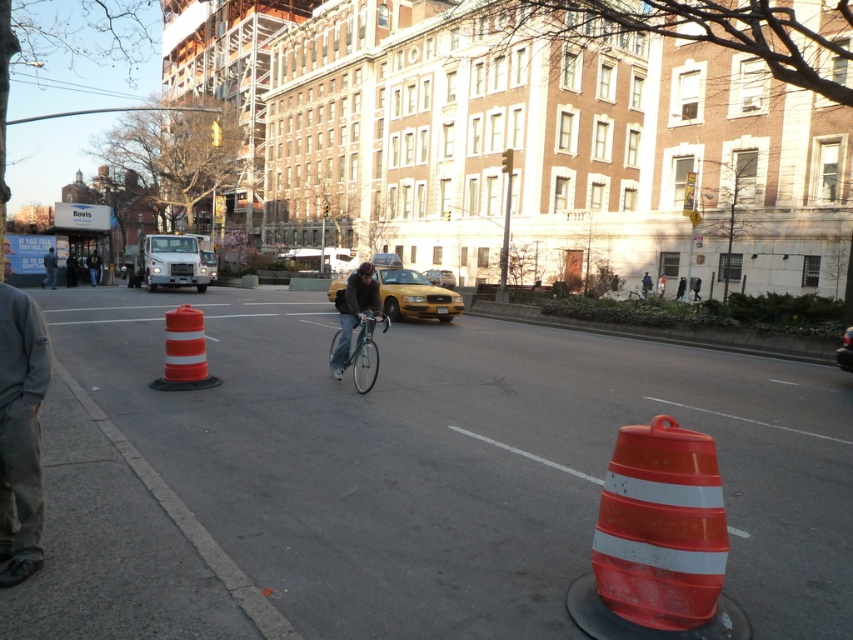
Can you confirm if dark gray pants at lower left is positioned below teal metallic bicycle at center?

Yes, dark gray pants at lower left is below teal metallic bicycle at center.

Between point (24, 458) and point (374, 348), which one is positioned in front?

Point (24, 458) is more forward.

Find the location of a particular element. dark gray pants at lower left is located at coordinates pyautogui.click(x=20, y=433).

Does orange reflective cone at center have a lesser height compared to dark gray pants at lower left?

Yes.

Based on the photo, can you confirm if orange reflective cone at center is positioned below dark gray pants at lower left?

Correct, orange reflective cone at center is located below dark gray pants at lower left.

Which is in front, point (192, 449) or point (33, 570)?

Point (33, 570) is in front.

Where is `orange reflective cone at center`? orange reflective cone at center is located at coordinates (461, 460).

Can you confirm if orange reflective cone at center is positioned to the left of orange reflective traffic cone at lower right?

Correct, you'll find orange reflective cone at center to the left of orange reflective traffic cone at lower right.

Is point (440, 472) closer to camera compared to point (712, 580)?

No, it is behind (712, 580).

Locate an element on the screen. orange reflective cone at center is located at coordinates (461, 460).

At what (x,y) coordinates should I click in order to perform the action: click on orange reflective cone at center. Please return your answer as a coordinate pair (x, y). The image size is (853, 640). Looking at the image, I should click on (461, 460).